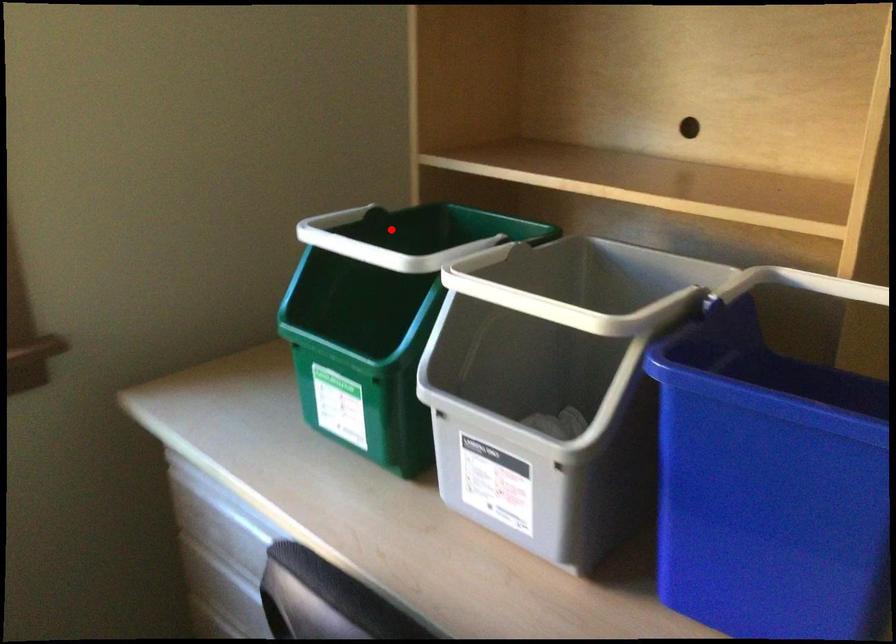
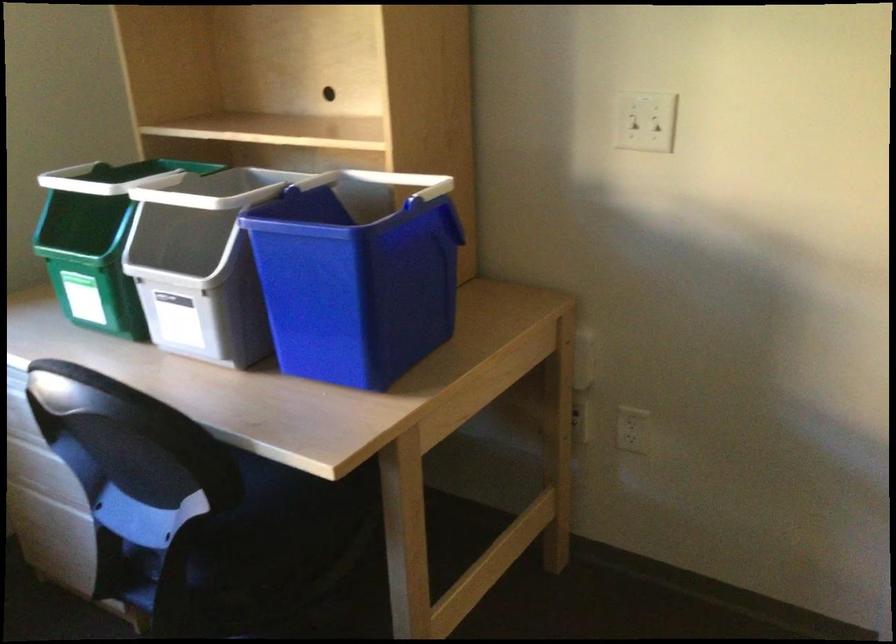
Question: I am providing you with two images of the same scene from different viewpoints. Image1 has a red point marked. In image2, the corresponding 3D location appears at what relative position? Reply with the corresponding letter.

Choices:
 (A) Closer
 (B) Farther

Answer: (B)